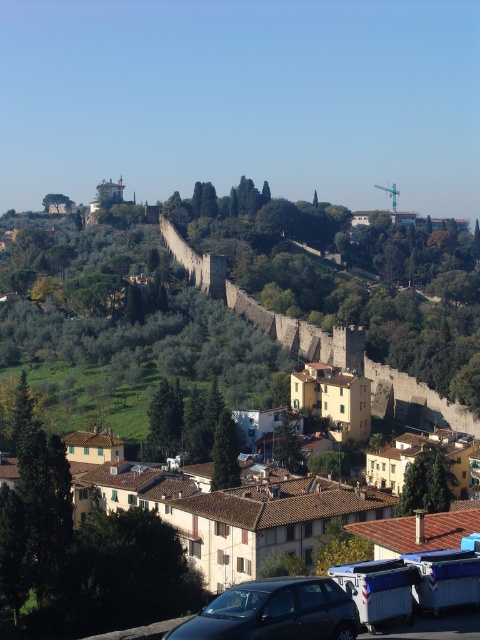
Question: Is yellow stucco buildings at center behind shiny black car at lower center?

Choices:
 (A) no
 (B) yes

Answer: (B)

Question: Which point appears closest to the camera in this image?

Choices:
 (A) (333, 580)
 (B) (342, 284)

Answer: (A)

Question: Is yellow stucco buildings at center above shiny black car at lower center?

Choices:
 (A) no
 (B) yes

Answer: (B)

Question: Is yellow stucco buildings at center in front of shiny black car at lower center?

Choices:
 (A) yes
 (B) no

Answer: (B)